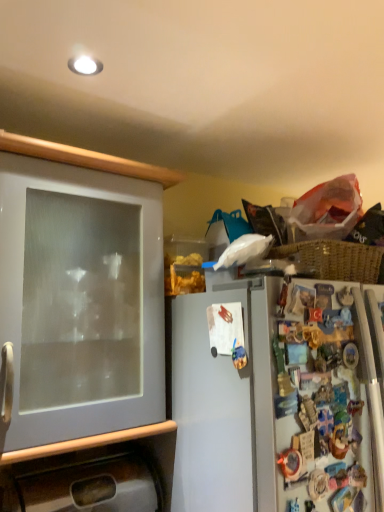
Question: Should I look upward or downward to see white glossy cabinet door at left, which is the first cabinetry from top to bottom?

Choices:
 (A) up
 (B) down

Answer: (B)

Question: From the image's perspective, is white glossy cabinet door at left, marked as the 2th cabinetry in a bottom-to-top arrangement, located beneath brushed metal sink at lower left, placed as the first cabinetry when sorted from bottom to top?

Choices:
 (A) no
 (B) yes

Answer: (A)

Question: Considering the relative sizes of white glossy cabinet door at left, marked as the 2th cabinetry in a bottom-to-top arrangement, and brushed metal sink at lower left, placed as the first cabinetry when sorted from bottom to top, in the image provided, is white glossy cabinet door at left, marked as the 2th cabinetry in a bottom-to-top arrangement, wider than brushed metal sink at lower left, placed as the first cabinetry when sorted from bottom to top,?

Choices:
 (A) yes
 (B) no

Answer: (A)

Question: Is the depth of white glossy cabinet door at left, marked as the 2th cabinetry in a bottom-to-top arrangement, less than that of brushed metal sink at lower left, the 2th cabinetry when ordered from top to bottom?

Choices:
 (A) no
 (B) yes

Answer: (B)

Question: Does white glossy cabinet door at left, marked as the 2th cabinetry in a bottom-to-top arrangement, have a smaller size compared to brushed metal sink at lower left, placed as the first cabinetry when sorted from bottom to top?

Choices:
 (A) no
 (B) yes

Answer: (A)

Question: Is white glossy cabinet door at left, which is the first cabinetry from top to bottom, next to brushed metal sink at lower left, the 2th cabinetry when ordered from top to bottom, and touching it?

Choices:
 (A) yes
 (B) no

Answer: (B)

Question: Is white glossy cabinet door at left, marked as the 2th cabinetry in a bottom-to-top arrangement, to the left of brushed metal sink at lower left, placed as the first cabinetry when sorted from bottom to top, from the viewer's perspective?

Choices:
 (A) no
 (B) yes

Answer: (B)

Question: Is brushed metal sink at lower left, the 2th cabinetry when ordered from top to bottom, not close to white glossy cabinet door at left, which is the first cabinetry from top to bottom?

Choices:
 (A) no
 (B) yes

Answer: (A)

Question: Could you tell me if brushed metal sink at lower left, placed as the first cabinetry when sorted from bottom to top, is facing white glossy cabinet door at left, marked as the 2th cabinetry in a bottom-to-top arrangement?

Choices:
 (A) yes
 (B) no

Answer: (B)

Question: Is brushed metal sink at lower left, the 2th cabinetry when ordered from top to bottom, outside of white glossy cabinet door at left, which is the first cabinetry from top to bottom?

Choices:
 (A) no
 (B) yes

Answer: (B)

Question: Is brushed metal sink at lower left, the 2th cabinetry when ordered from top to bottom, at the right side of white glossy cabinet door at left, marked as the 2th cabinetry in a bottom-to-top arrangement?

Choices:
 (A) no
 (B) yes

Answer: (B)

Question: From the image's perspective, is brushed metal sink at lower left, placed as the first cabinetry when sorted from bottom to top, under white glossy cabinet door at left, marked as the 2th cabinetry in a bottom-to-top arrangement?

Choices:
 (A) yes
 (B) no

Answer: (A)

Question: Does brushed metal sink at lower left, placed as the first cabinetry when sorted from bottom to top, have a lesser height compared to white glossy cabinet door at left, which is the first cabinetry from top to bottom?

Choices:
 (A) yes
 (B) no

Answer: (A)

Question: Is brushed metal sink at lower left, the 2th cabinetry when ordered from top to bottom, spatially inside white glossy cabinet door at left, which is the first cabinetry from top to bottom, or outside of it?

Choices:
 (A) outside
 (B) inside

Answer: (A)